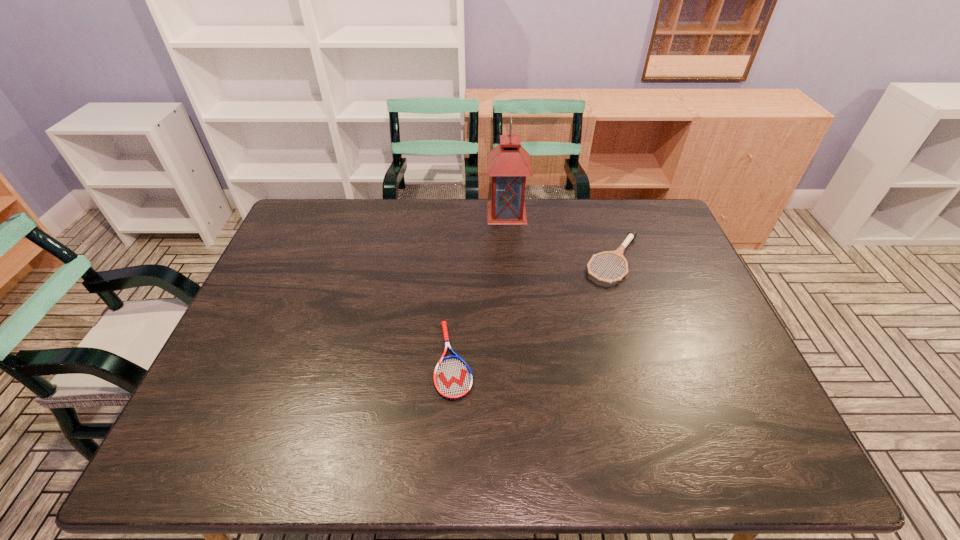
Select which object appears as the closest to the leftmost object. Please provide its 2D coordinates. Your answer should be formatted as a tuple, i.e. [(x, y)], where the tuple contains the x and y coordinates of a point satisfying the conditions above.

[(632, 234)]

Image resolution: width=960 pixels, height=540 pixels. I want to click on vacant space that satisfies the following two spatial constraints: 1. on the back side of the nearer tennis racket; 2. on the right side of the second object from right to left, so click(x=462, y=213).

You are a GUI agent. You are given a task and a screenshot of the screen. Output one action in this format:
    pyautogui.click(x=<x>, y=<y>)
    Task: Click on the vacant area in the image that satisfies the following two spatial constraints: 1. on the front side of the taller tennis racket; 2. on the left side of the farthest object
    
    Given the screenshot: What is the action you would take?
    pyautogui.click(x=510, y=260)